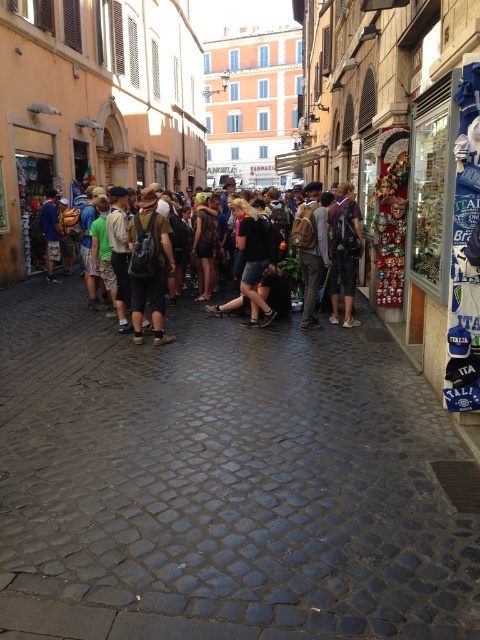
You are standing at the point marked as point (311, 248) in the image. What object is located exactly at that point?

The brown backpack at center is located exactly at point (311, 248).

You are standing at the point with coordinates point (200, 253) and want to walk to the point with coordinates point (257, 241). Which direction should you move relative to your current position?

You should move forward because point (257, 241) is in front of point (200, 253).

You are a tourist standing on the cobblestone street in front of the shop. You see the multicolored backpacks at center and the dark brown leather jacket at center. Which item is positioned to the right when viewed from your perspective?

The multicolored backpacks at center are to the right of the dark brown leather jacket at center, so the backpacks are positioned to the right.